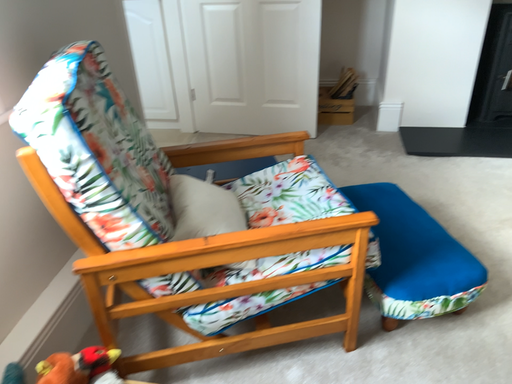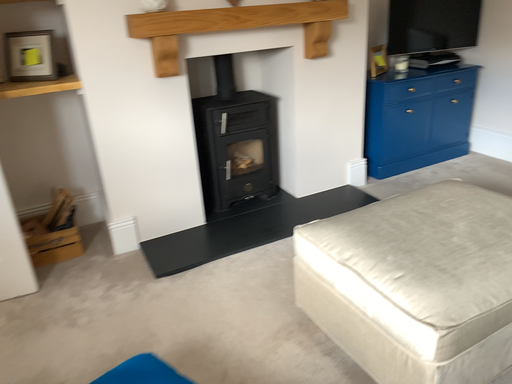
Question: Which way did the camera rotate in the video?

Choices:
 (A) rotated left
 (B) rotated right

Answer: (B)